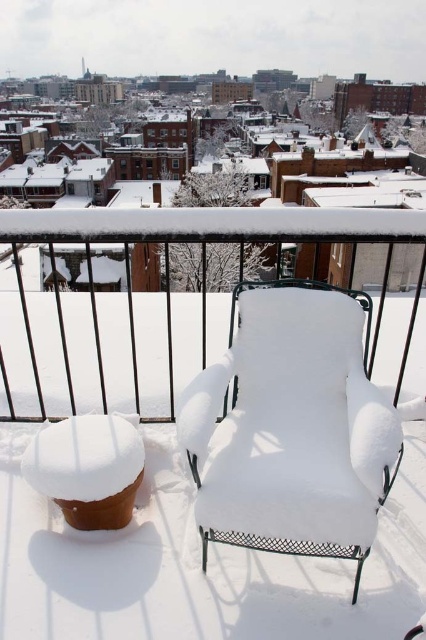
Based on the photo, is white snow-covered chair at center above white fabric chair at center?

Yes, white snow-covered chair at center is above white fabric chair at center.

Can you confirm if white snow-covered chair at center is positioned below white fabric chair at center?

No, white snow-covered chair at center is not below white fabric chair at center.

Who is more forward, (86, 275) or (232, 394)?

Point (232, 394) is more forward.

The image size is (426, 640). I want to click on white snow-covered chair at center, so click(175, 308).